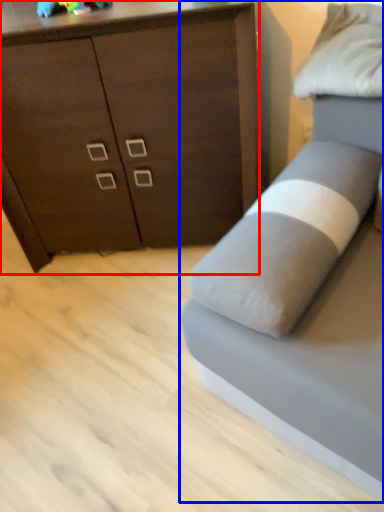
Question: Which point is further to the camera, chest of drawers (highlighted by a red box) or studio couch (highlighted by a blue box)?

Choices:
 (A) chest of drawers
 (B) studio couch

Answer: (A)